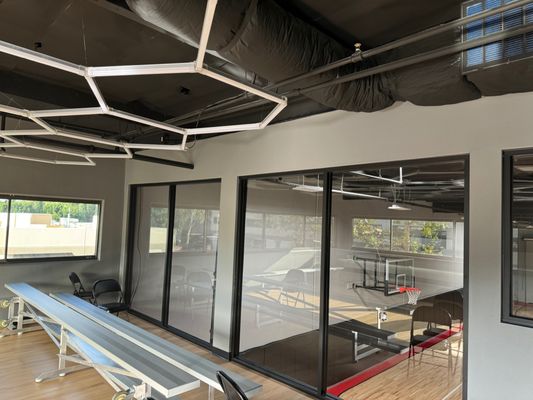
Where is `black chair`? Image resolution: width=533 pixels, height=400 pixels. black chair is located at coordinates (79, 288).